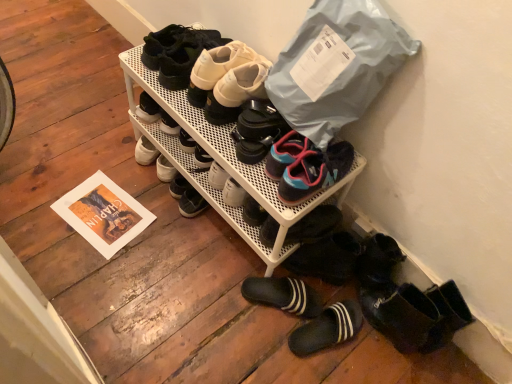
Question: From a real-world perspective, is white mesh shoe rack at center, which is counted as the fourth footwear, starting from the top, above or below black rubber slippers at lower center, which is counted as the eighth footwear, starting from the top?

Choices:
 (A) above
 (B) below

Answer: (A)

Question: Based on their sizes in the image, would you say white mesh shoe rack at center, which is counted as the fourth footwear, starting from the top, is bigger or smaller than black rubber slippers at lower center, which is counted as the eighth footwear, starting from the top?

Choices:
 (A) small
 (B) big

Answer: (B)

Question: Estimate the real-world distances between objects in this image. Which object is closer to the white matte sneakers at upper center, which is the seventh footwear in bottom-to-top order?

Choices:
 (A) black rubber slippers at lower center, which is counted as the eighth footwear, starting from the top
 (B) matte black shoes at upper center, marked as the first footwear in a top-to-bottom arrangement
 (C) blue rubber sandals at center, the 5th footwear positioned from the top
 (D) black rubber shoe at center, the sixth footwear positioned from the bottom
 (E) white mesh shoe rack at center, the 5th footwear ordered from the bottom

Answer: (B)

Question: Estimate the real-world distances between objects in this image. Which object is closer to the black rubber shoes at center?

Choices:
 (A) black rubber slippers at lower center, the 1th footwear in the bottom-to-top sequence
 (B) white mesh shoe rack at center, the 5th footwear ordered from the bottom
 (C) blue mesh sneakers at center, positioned as the 3th footwear in bottom-to-top order
 (D) white matte sneakers at upper center, positioned as the 2th footwear in top-to-bottom order
 (E) black rubber shoe at center, the sixth footwear positioned from the bottom

Answer: (B)